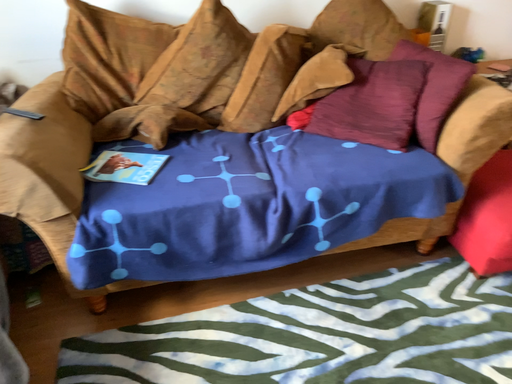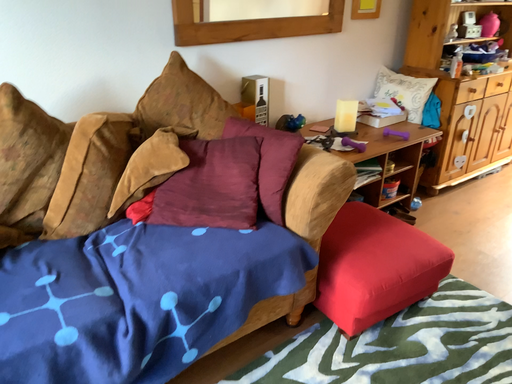
Question: Which way did the camera rotate in the video?

Choices:
 (A) rotated upward
 (B) rotated downward

Answer: (A)